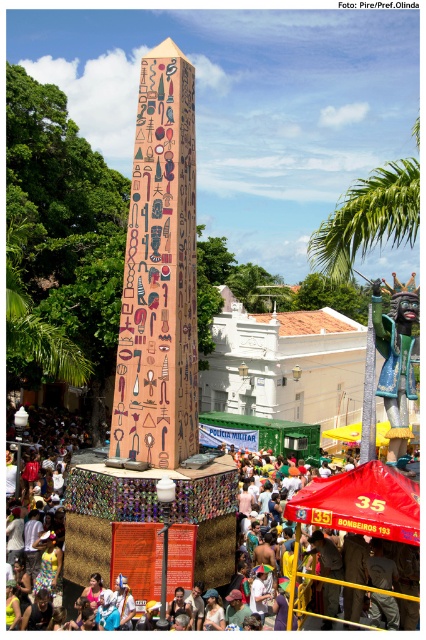
Question: Can you confirm if polychrome mosaic statue at right is bigger than carved wood totem pole at center?

Choices:
 (A) yes
 (B) no

Answer: (A)

Question: Which of the following is the closest to the observer?

Choices:
 (A) red fabric canopy at center
 (B) multicolored mosaic crowd at center
 (C) matte pink obelisk at center

Answer: (A)

Question: Which object is closer to the camera taking this photo?

Choices:
 (A) carved wood totem pole at center
 (B) multicolored mosaic crowd at center
 (C) matte pink obelisk at center

Answer: (B)

Question: Can you confirm if multicolored mosaic crowd at center is positioned below red fabric canopy at center?

Choices:
 (A) no
 (B) yes

Answer: (B)

Question: Which object appears closest to the camera in this image?

Choices:
 (A) red fabric canopy at center
 (B) carved wood totem pole at center
 (C) beige mosaic obelisk at center

Answer: (A)

Question: Can you confirm if beige mosaic obelisk at center is positioned below red fabric canopy at center?

Choices:
 (A) no
 (B) yes

Answer: (A)